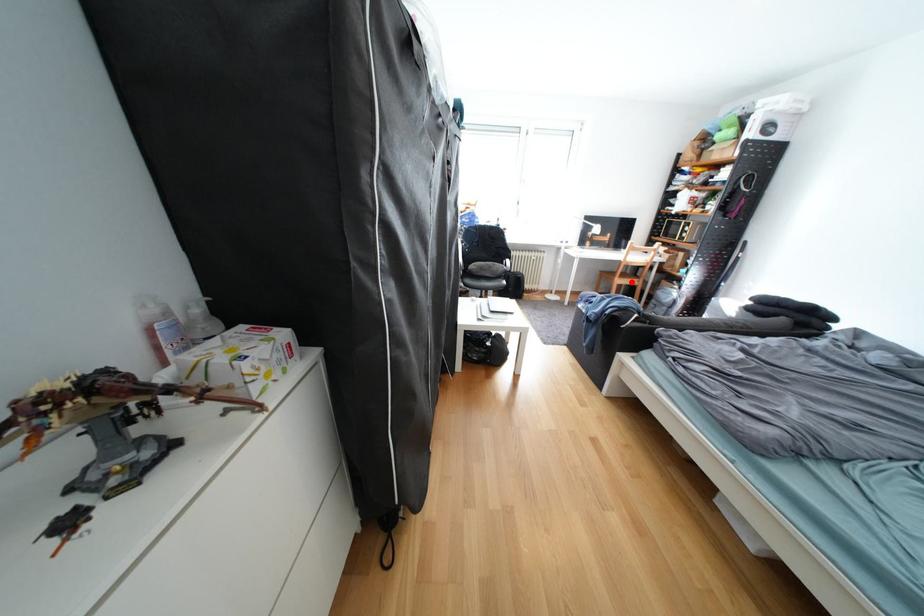
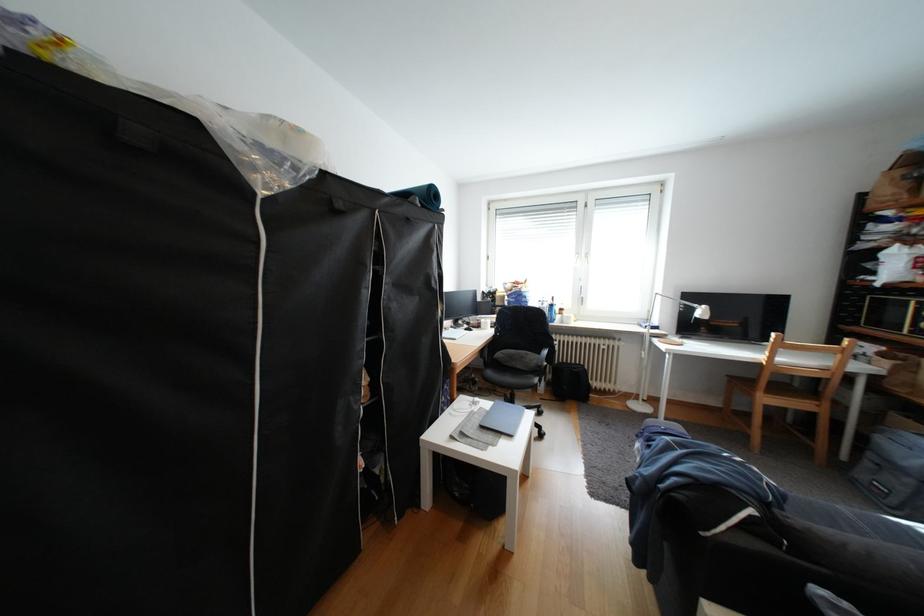
Question: I am providing you with two images of the same scene from different viewpoints. A red point is shown in image1. For the corresponding object point in image2, is it positioned nearer or farther from the camera?

Choices:
 (A) Nearer
 (B) Farther

Answer: (B)